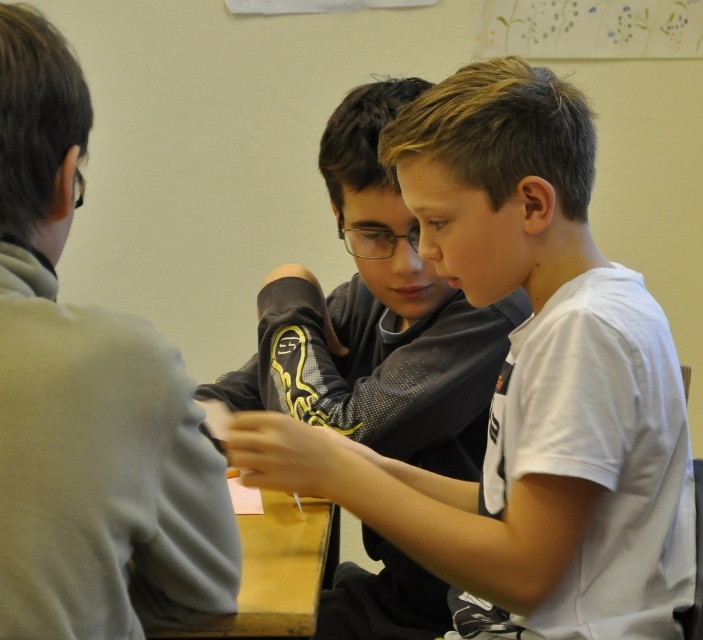
In the scene described, there are three children at a table. One child is wearing a light gray sweater and is located at the left side of the image. Another child is wearing a white T shirt and is pointing at a point marked as (89, 401). The third child is wearing a dark jacket with yellow accents. Based on the coordinates given, can you determine which child the marked point corresponds to?

The point at (89, 401) corresponds to the light gray sweater at left as it is marked there.

You are standing at the table where the children are working. There are two points marked on the paper they are looking at. Which point is closer to you, point (109, 582) or point (262, 625)?

Point (109, 582) is in front of point (262, 625), so it is closer to you.